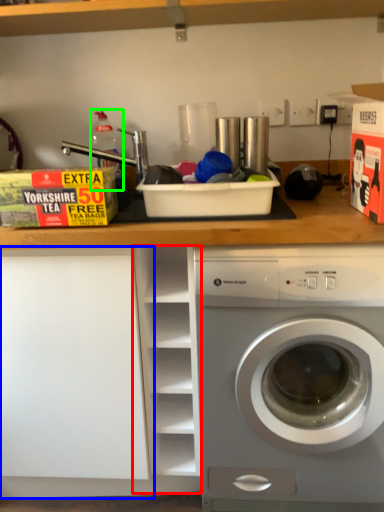
Question: Which object is positioned farthest from cabinet (highlighted by a red box)? Select from shelf (highlighted by a blue box) and bottle (highlighted by a green box).

Choices:
 (A) shelf
 (B) bottle

Answer: (B)